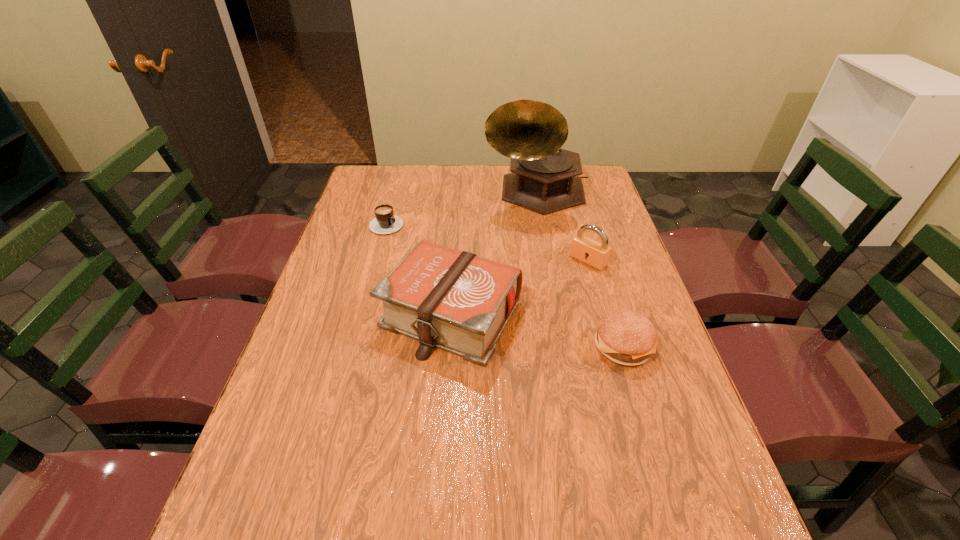
The width and height of the screenshot is (960, 540). I want to click on vacant area in the image that satisfies the following two spatial constraints: 1. on the front side of the shortest object; 2. on the right side of the padlock, so click(x=377, y=261).

The image size is (960, 540). I want to click on free point that satisfies the following two spatial constraints: 1. on the back side of the Bible; 2. on the right side of the tallest object, so click(x=459, y=192).